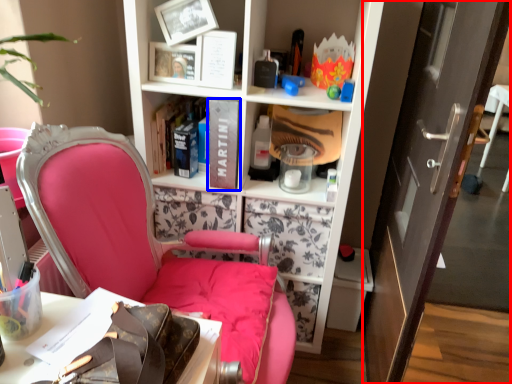
Question: Among these objects, which one is farthest to the camera, door (highlighted by a red box) or book (highlighted by a blue box)?

Choices:
 (A) door
 (B) book

Answer: (B)